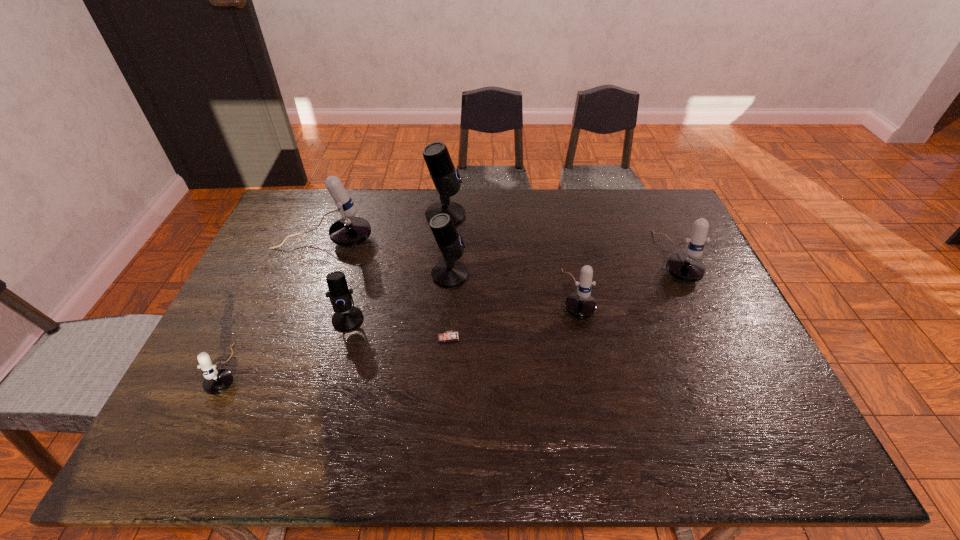
Identify the location of free spot that satisfies the following two spatial constraints: 1. on the stand of the second smallest black microphone; 2. on the stand of the smallest black microphone. (446, 319).

Locate an element on the screen. Image resolution: width=960 pixels, height=540 pixels. vacant space that satisfies the following two spatial constraints: 1. on the stand of the shortest object; 2. on the left side of the second biggest black microphone is located at coordinates (445, 337).

The image size is (960, 540). I want to click on vacant area that satisfies the following two spatial constraints: 1. on the stand of the farthest black microphone; 2. on the stand of the leftmost black microphone, so click(x=436, y=319).

Find the location of a particular element. free spot that satisfies the following two spatial constraints: 1. on the stand of the shortest object; 2. on the left side of the second biggest black microphone is located at coordinates (445, 337).